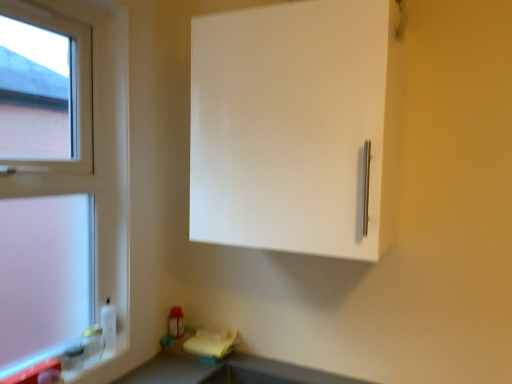
Question: Is smooth gray countertop at lower center bigger than white matte cabinet at upper right?

Choices:
 (A) no
 (B) yes

Answer: (A)

Question: Can you confirm if smooth gray countertop at lower center is smaller than white matte cabinet at upper right?

Choices:
 (A) yes
 (B) no

Answer: (A)

Question: From the image's perspective, is smooth gray countertop at lower center beneath white matte cabinet at upper right?

Choices:
 (A) yes
 (B) no

Answer: (A)

Question: From the image's perspective, would you say smooth gray countertop at lower center is positioned over white matte cabinet at upper right?

Choices:
 (A) no
 (B) yes

Answer: (A)

Question: Is white matte cabinet at upper right located within smooth gray countertop at lower center?

Choices:
 (A) yes
 (B) no

Answer: (B)

Question: From a real-world perspective, is white plastic window at left positioned above or below smooth gray countertop at lower center?

Choices:
 (A) below
 (B) above

Answer: (B)

Question: Is white plastic window at left bigger or smaller than smooth gray countertop at lower center?

Choices:
 (A) big
 (B) small

Answer: (A)

Question: Is white plastic window at left to the left or to the right of smooth gray countertop at lower center in the image?

Choices:
 (A) right
 (B) left

Answer: (B)

Question: In the image, is white plastic window at left positioned in front of or behind smooth gray countertop at lower center?

Choices:
 (A) front
 (B) behind

Answer: (B)

Question: Is smooth gray countertop at lower center wider or thinner than white matte cabinet at upper right?

Choices:
 (A) wide
 (B) thin

Answer: (A)

Question: Considering the positions of smooth gray countertop at lower center and white matte cabinet at upper right in the image, is smooth gray countertop at lower center taller or shorter than white matte cabinet at upper right?

Choices:
 (A) short
 (B) tall

Answer: (A)

Question: Would you say smooth gray countertop at lower center is to the left or to the right of white matte cabinet at upper right in the picture?

Choices:
 (A) left
 (B) right

Answer: (A)

Question: From the image's perspective, is smooth gray countertop at lower center positioned above or below white matte cabinet at upper right?

Choices:
 (A) above
 (B) below

Answer: (B)

Question: From a real-world perspective, is white matte cabinet at upper right positioned above or below white plastic window at left?

Choices:
 (A) above
 (B) below

Answer: (A)

Question: In the image, is white matte cabinet at upper right on the left side or the right side of white plastic window at left?

Choices:
 (A) right
 (B) left

Answer: (A)